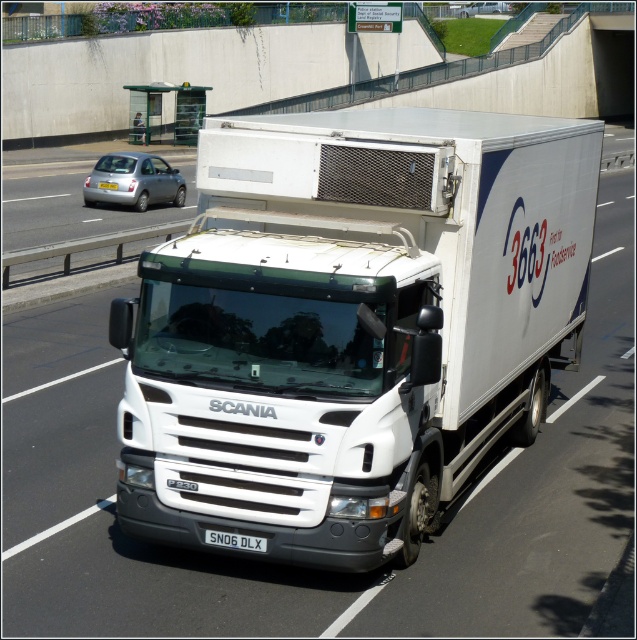
Which of these two, white matte truck at center or silver metallic hatchback at left, stands taller?

white matte truck at center

Can you confirm if white matte truck at center is wider than silver metallic hatchback at left?

Yes, white matte truck at center is wider than silver metallic hatchback at left.

Where is `white matte truck at center`? The height and width of the screenshot is (640, 637). white matte truck at center is located at coordinates (350, 324).

Is silver metallic hatchback at left positioned in front of black plastic license plate at center?

No, it is not.

Looking at this image, does silver metallic hatchback at left have a lesser height compared to black plastic license plate at center?

In fact, silver metallic hatchback at left may be taller than black plastic license plate at center.

Is point (97, 173) farther from viewer compared to point (254, 544)?

Yes, point (97, 173) is farther from viewer.

This screenshot has height=640, width=637. Identify the location of silver metallic hatchback at left. (134, 180).

Does white matte truck at center appear on the right side of black plastic license plate at center?

In fact, white matte truck at center is to the left of black plastic license plate at center.

Can you confirm if white matte truck at center is positioned above black plastic license plate at center?

Indeed, white matte truck at center is positioned over black plastic license plate at center.

Is point (469, 433) positioned before point (255, 538)?

No, it is not.

The image size is (637, 640). I want to click on white matte truck at center, so click(x=350, y=324).